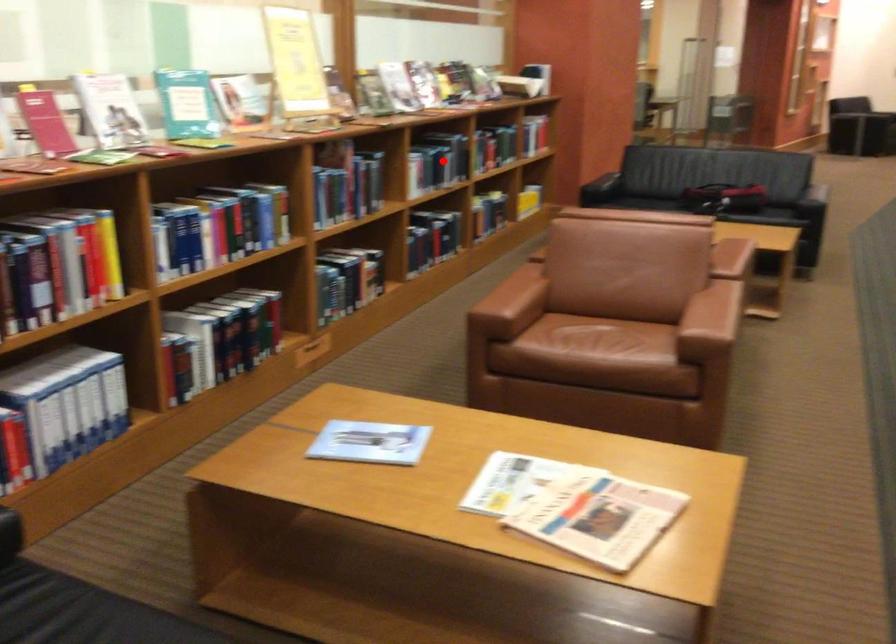
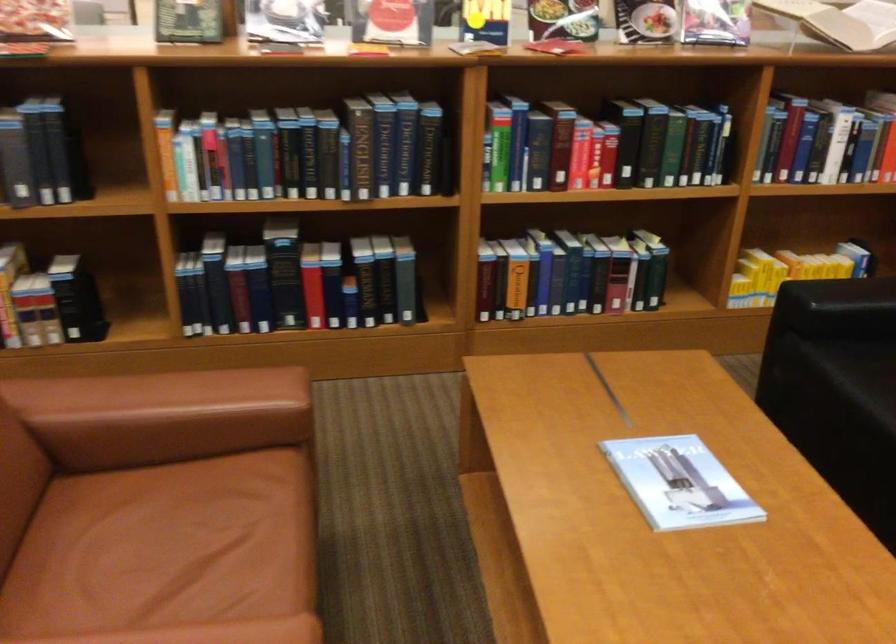
Question: I am providing you with two images of the same scene from different viewpoints. A red point is marked on the first image. Is the red point's position out of view in image 2?

Choices:
 (A) Yes
 (B) No

Answer: (B)